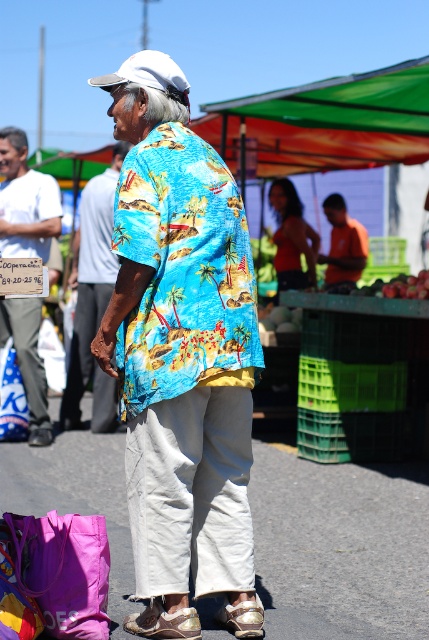
Question: Which of the following is the farthest from the observer?

Choices:
 (A) metallic gold sandal at lower center
 (B) green fabric canopy at upper center
 (C) shiny blue shirt at center
 (D) matte white signboard at left

Answer: (B)

Question: Is green fabric canopy at upper center positioned at the back of metallic gold sandal at lower center?

Choices:
 (A) yes
 (B) no

Answer: (A)

Question: Is green fabric canopy at upper center positioned behind matte orange shirt at center?

Choices:
 (A) yes
 (B) no

Answer: (B)

Question: Estimate the real-world distances between objects in this image. Which object is farther from the green fabric canopy at upper center?

Choices:
 (A) matte orange shirt at center
 (B) metallic gold sandal at lower center

Answer: (B)

Question: Which point is farther to the camera?

Choices:
 (A) (260, 609)
 (B) (352, 140)
 (C) (296, 227)

Answer: (C)

Question: Does orange matte shirt at center have a larger size compared to metallic gold sandal at lower center?

Choices:
 (A) no
 (B) yes

Answer: (B)